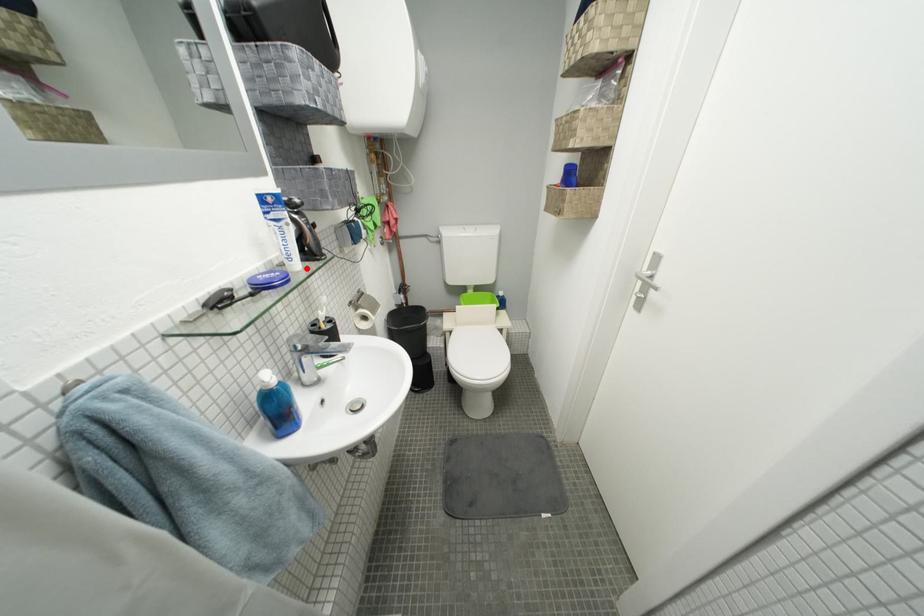
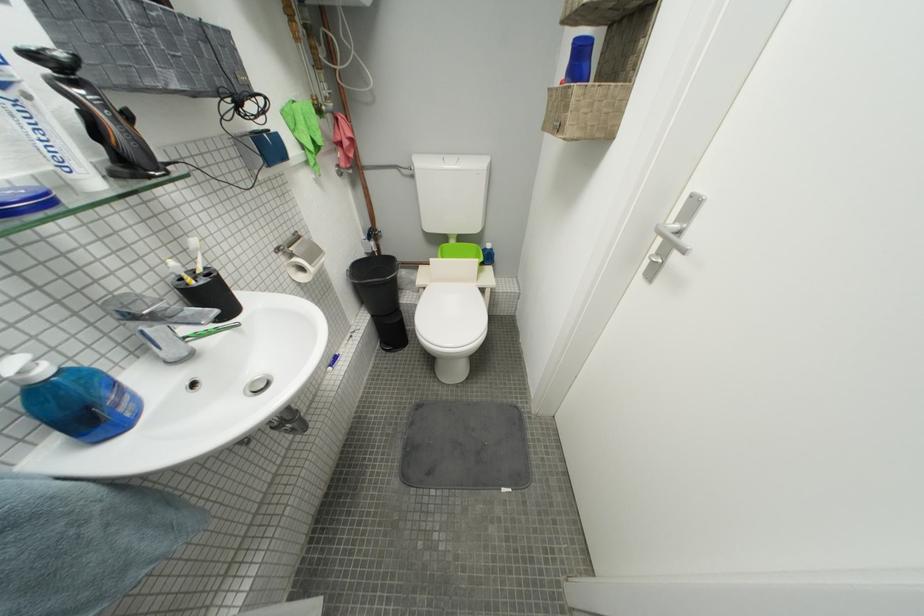
Find the pixel in the second image that matches the highlighted location in the first image.

(103, 185)